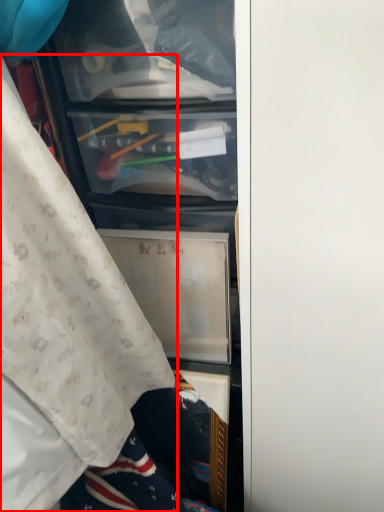
Question: In this image, where is curtain (annotated by the red box) located relative to door?

Choices:
 (A) left
 (B) right

Answer: (A)